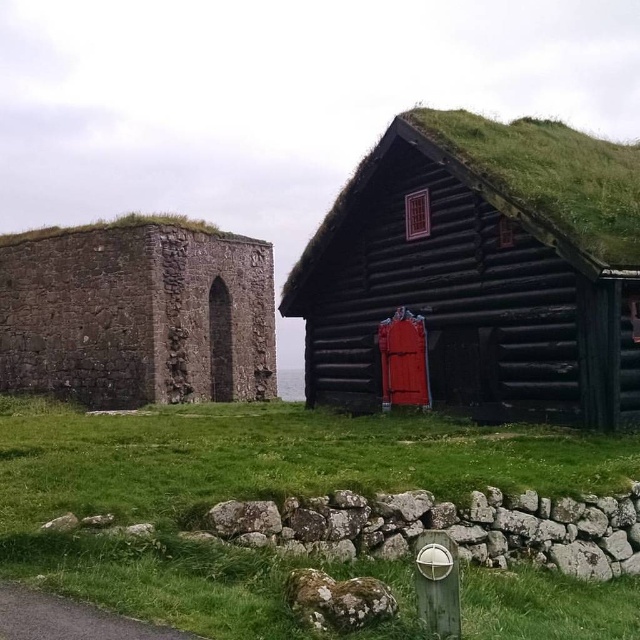
You are standing in the open area and want to take a photo of both the dark brown wooden log cabin at center and the rustic stone wall at left. Which one should you focus on first to ensure both are in clear view?

You should focus on the rustic stone wall at left first because it is farther away from you than the dark brown wooden log cabin at center, so adjusting focus from near to far will help capture both in clear view.

From the picture: You are standing in the open area between the two structures and want to place a small flag at the point closer to you. Which point should you choose between point (x=132, y=458) and point (x=202, y=342)?

You should choose point (x=132, y=458) because it is closer to the camera than point (x=202, y=342).